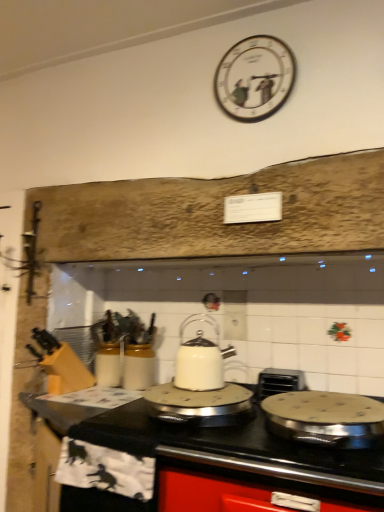
Question: In the image, is white glossy countertop at center on the left side or the right side of white painted wood clock at upper center?

Choices:
 (A) right
 (B) left

Answer: (B)

Question: From the image's perspective, is white glossy countertop at center positioned above or below white painted wood clock at upper center?

Choices:
 (A) below
 (B) above

Answer: (A)

Question: Which object is the closest to the white glossy kettle at center, which is counted as the 2th kitchen appliance, starting from the left?

Choices:
 (A) silver metallic toaster at center
 (B) stainless steel frying pan at center, which is counted as the third kitchen appliance, starting from the left
 (C) white glossy kettle at center, placed as the 1th kitchen appliance when sorted from left to right
 (D) white glossy countertop at center
 (E) white painted wood clock at upper center

Answer: (C)

Question: Based on their relative distances, which object is farther from the silver metallic toaster at center?

Choices:
 (A) stainless steel frying pan at center, which is counted as the third kitchen appliance, starting from the left
 (B) white painted wood clock at upper center
 (C) white glossy countertop at center
 (D) white glossy kettle at center, the third kitchen appliance positioned from the right
 (E) white glossy kettle at center, which is the second kitchen appliance from right to left

Answer: (B)